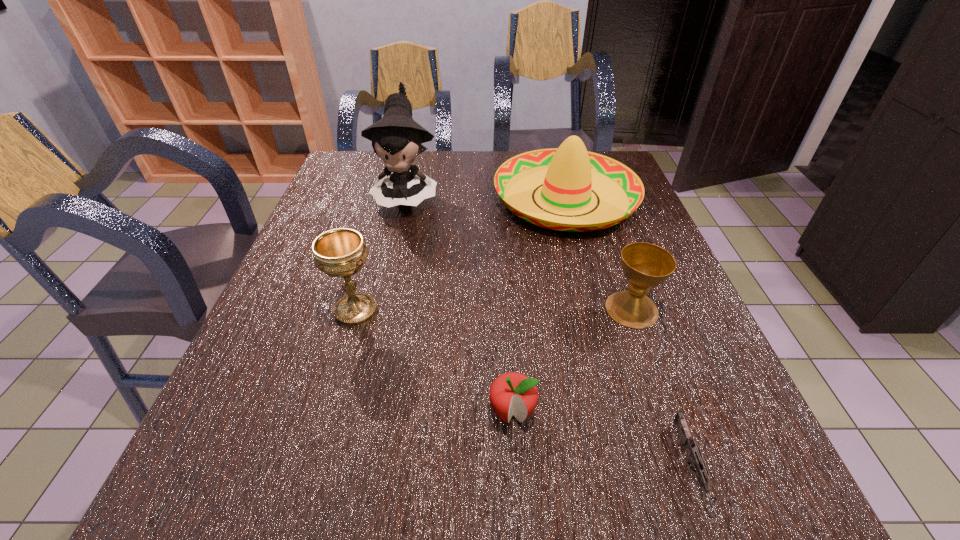
Image resolution: width=960 pixels, height=540 pixels. What are the coordinates of `object that is at the far left corner` in the screenshot? It's located at (396, 138).

Find the location of `object positioned at the far right corner`. object positioned at the far right corner is located at coordinates (569, 173).

You are a GUI agent. You are given a task and a screenshot of the screen. Output one action in this format:
    pyautogui.click(x=<x>, y=<y>)
    Task: Click on the object located in the near right corner section of the desktop
    This screenshot has height=540, width=960.
    Given the screenshot: What is the action you would take?
    pyautogui.click(x=695, y=457)

Locate an element on the screen. The width and height of the screenshot is (960, 540). vacant space at the far edge is located at coordinates (440, 178).

This screenshot has width=960, height=540. In the image, there is a desktop. What are the coordinates of `free space at the near edge` in the screenshot? It's located at tap(573, 471).

I want to click on vacant space at the left edge, so click(363, 194).

Where is `vacant region at the far left corner of the desktop`? Image resolution: width=960 pixels, height=540 pixels. vacant region at the far left corner of the desktop is located at coordinates (378, 168).

Locate an element on the screen. vacant point located between the taller chalice and the doll is located at coordinates (381, 253).

At what (x,y) coordinates should I click in order to perform the action: click on free spot between the left chalice and the tallest object. Please return your answer as a coordinate pair (x, y). Looking at the image, I should click on (381, 253).

Where is `free spot between the fifth tallest object and the shorter chalice`? free spot between the fifth tallest object and the shorter chalice is located at coordinates (572, 361).